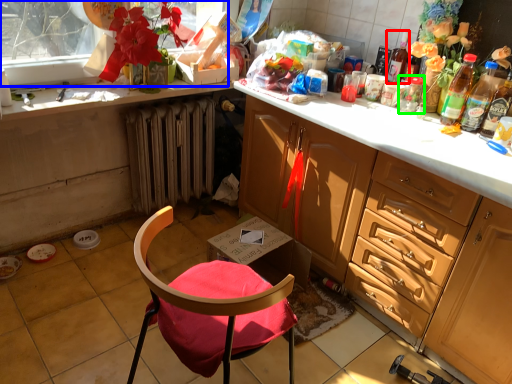
Question: Which object is the farthest from bottle (highlighted by a red box)? Choose among these: window screen (highlighted by a blue box) or glass jar (highlighted by a green box).

Choices:
 (A) window screen
 (B) glass jar

Answer: (A)